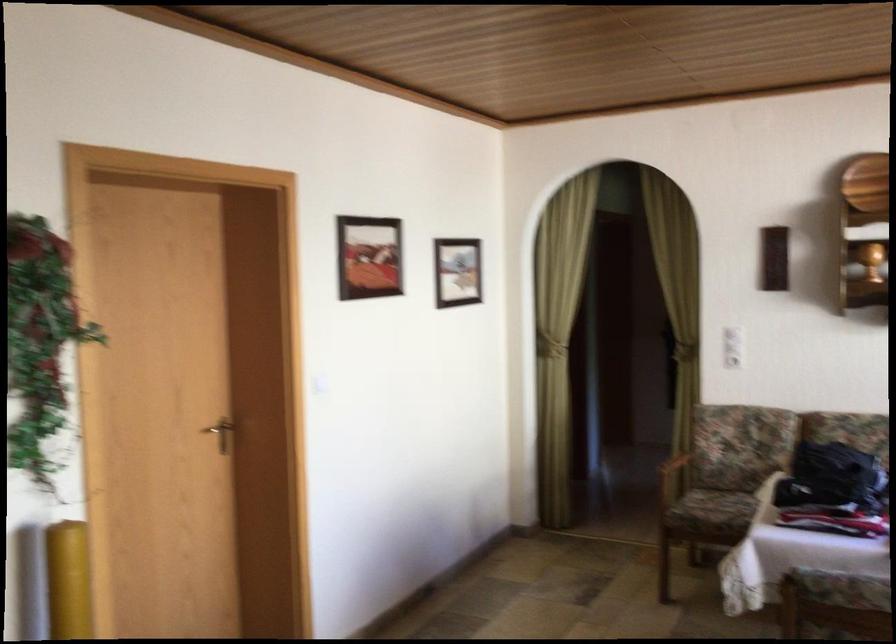
Based on the continuous images, in which direction is the camera rotating?

The camera's rotation is toward right-up.